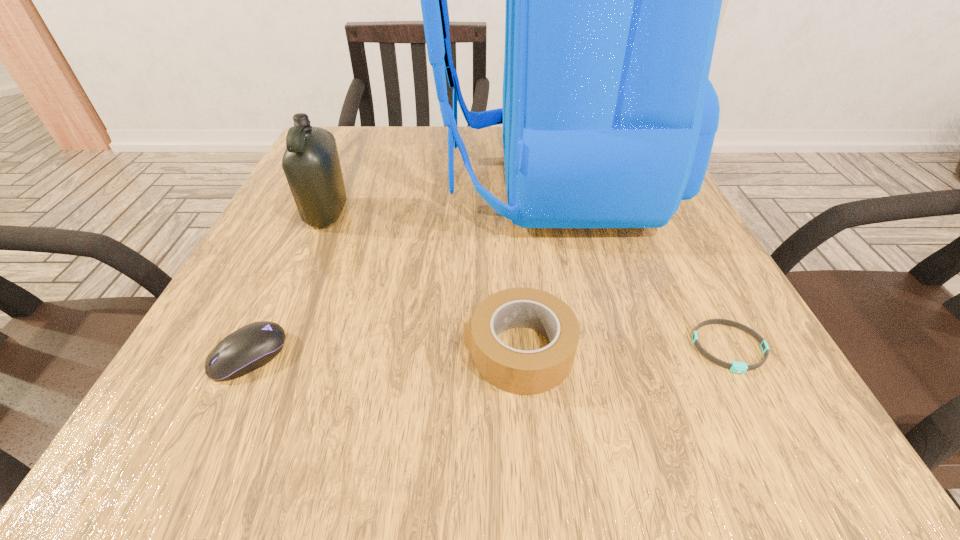
Identify the location of vacant region located at the edge of the third tallest object. (248, 350).

The image size is (960, 540). In order to click on vacant space located at the edge of the third tallest object in this screenshot , I will do `click(277, 350)`.

In order to click on free space located 0.310m on the right of the computer mouse in this screenshot , I will do `click(518, 355)`.

Identify the location of free space located 0.060m on the buckle of the shortest object. This screenshot has width=960, height=540. (765, 418).

What are the coordinates of `object positioned at the far edge` in the screenshot? It's located at (613, 0).

Identify the location of bottle at the left edge. Image resolution: width=960 pixels, height=540 pixels. (311, 164).

The width and height of the screenshot is (960, 540). I want to click on computer mouse that is at the left edge, so click(252, 346).

Where is `backpack present at the right edge`? Image resolution: width=960 pixels, height=540 pixels. backpack present at the right edge is located at coordinates (613, 0).

The height and width of the screenshot is (540, 960). What are the coordinates of `wristband present at the right edge` in the screenshot? It's located at (737, 367).

Find the location of a particular element. object located at the far right corner is located at coordinates (613, 0).